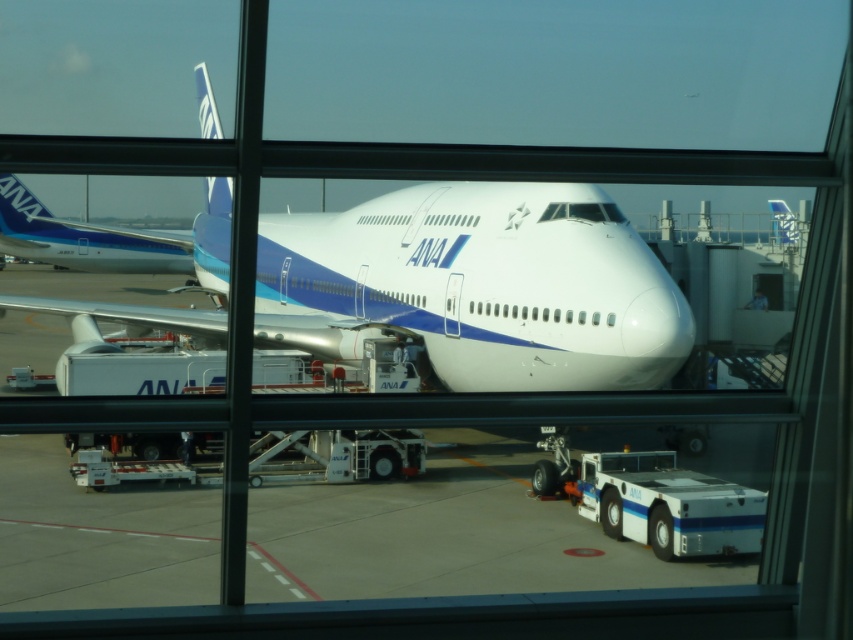
You are a passenger waiting at the airport gate. You see the white glossy airplane at center and the matte blue airplane at left through the window. Which airplane is closer to you?

The white glossy airplane at center is closer to you because it is in front of the matte blue airplane at left.

You are a maintenance worker at the airport. You need to inspect the height of both the white glossy airplane at center and the matte blue airplane at left. Based on the scene, which airplane requires a taller ladder for inspection?

The white glossy airplane at center requires a taller ladder for inspection because it is much taller than the matte blue airplane at left.

Where is the white glossy airplane at center located in the image?

The white glossy airplane at center is located at point coordinates of (479, 285).